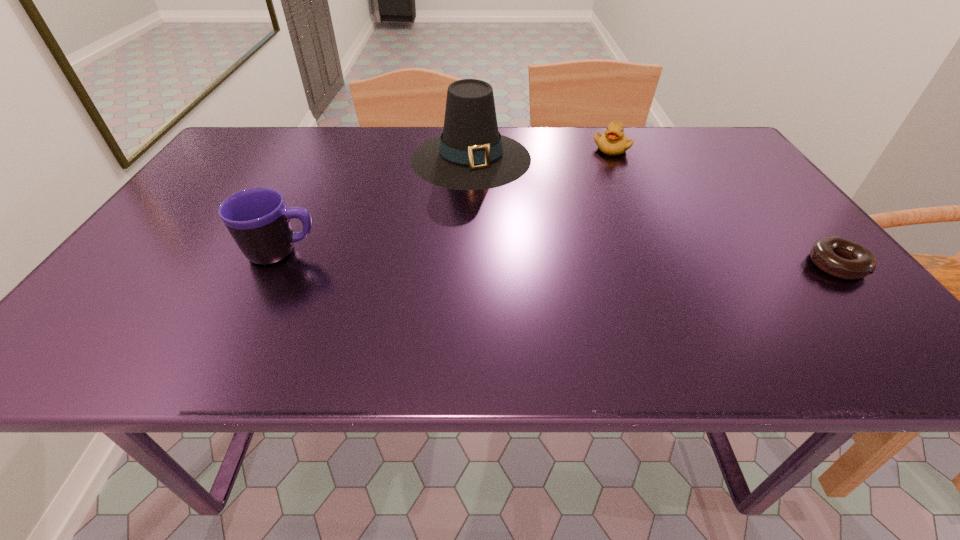
Identify the location of the second tallest object. The image size is (960, 540). (257, 218).

Identify the location of mug. The height and width of the screenshot is (540, 960). (257, 218).

The height and width of the screenshot is (540, 960). In order to click on the rightmost object in this screenshot , I will do `click(839, 257)`.

You are a GUI agent. You are given a task and a screenshot of the screen. Output one action in this format:
    pyautogui.click(x=<x>, y=<y>)
    Task: Click on the shortest object
    The image size is (960, 540).
    Given the screenshot: What is the action you would take?
    pyautogui.click(x=839, y=257)

Where is `hat`? This screenshot has height=540, width=960. hat is located at coordinates (471, 154).

You are a GUI agent. You are given a task and a screenshot of the screen. Output one action in this format:
    pyautogui.click(x=<x>, y=<y>)
    Task: Click on the second object from left to right
    The width and height of the screenshot is (960, 540).
    Given the screenshot: What is the action you would take?
    pyautogui.click(x=471, y=154)

At what (x,y) coordinates should I click in order to perform the action: click on the third tallest object. Please return your answer as a coordinate pair (x, y). This screenshot has height=540, width=960. Looking at the image, I should click on (614, 141).

The height and width of the screenshot is (540, 960). Find the location of `the second object from right to left`. the second object from right to left is located at coordinates (614, 141).

The image size is (960, 540). I want to click on vacant space located with the handle on the side of the leftmost object, so click(462, 252).

You are a GUI agent. You are given a task and a screenshot of the screen. Output one action in this format:
    pyautogui.click(x=<x>, y=<y>)
    Task: Click on the free region located on the left of the rightmost object
    This screenshot has width=960, height=540.
    Given the screenshot: What is the action you would take?
    pyautogui.click(x=717, y=265)